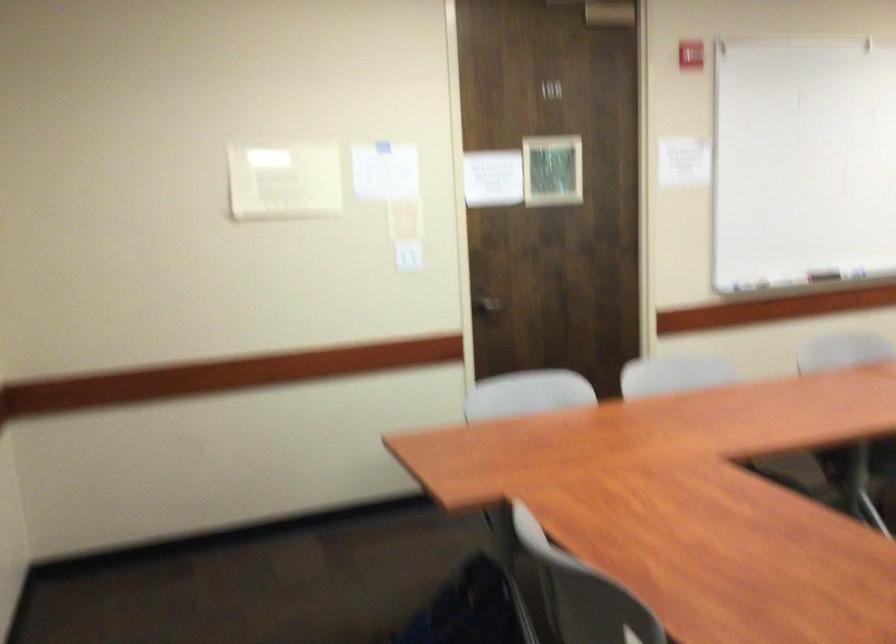
Based on the continuous images, in which direction is the camera rotating?

The camera rotated toward left-down.